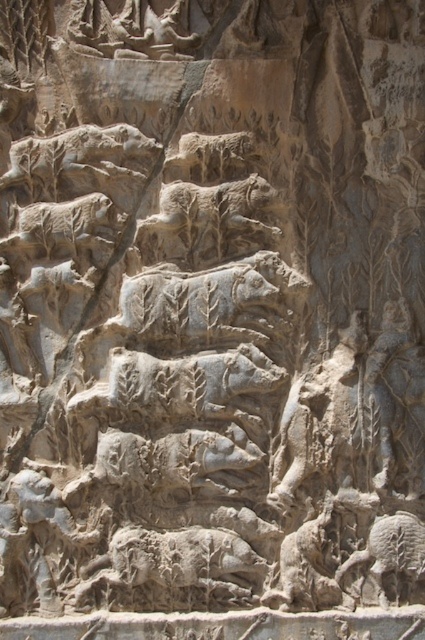
Question: Does gray stone lion at center have a lesser width compared to gray stone lion at upper center?

Choices:
 (A) yes
 (B) no

Answer: (B)

Question: Which object is closer to the camera taking this photo?

Choices:
 (A) gray stone lion at upper center
 (B) gray stone lion at center
 (C) gray stone boar at center

Answer: (C)

Question: Considering the relative positions of gray stone lion at center and gray stone boar at center in the image provided, where is gray stone lion at center located with respect to gray stone boar at center?

Choices:
 (A) right
 (B) left

Answer: (A)

Question: Does gray stone boar at center lie behind gray stone lion at upper center?

Choices:
 (A) yes
 (B) no

Answer: (B)

Question: Which object appears farthest from the camera in this image?

Choices:
 (A) gray stone lion at center
 (B) gray stone boar at center
 (C) gray stone lion at upper center

Answer: (C)

Question: Which point is farther to the camera?

Choices:
 (A) (42, 230)
 (B) (172, 186)

Answer: (B)